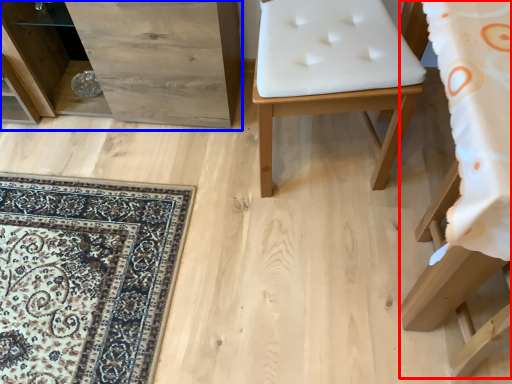
Question: Among these objects, which one is nearest to the camera, furniture (highlighted by a red box) or dresser (highlighted by a blue box)?

Choices:
 (A) furniture
 (B) dresser

Answer: (A)